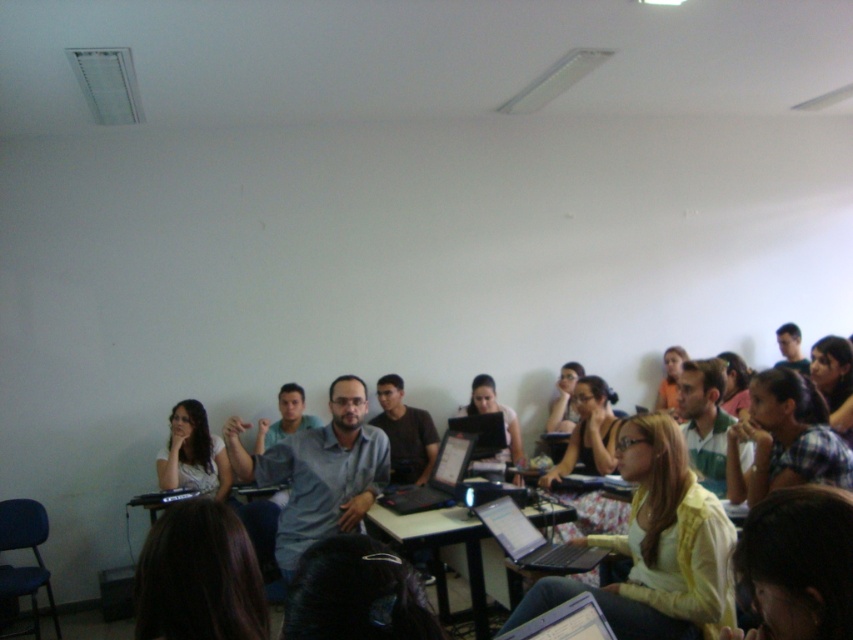
Question: Which point is farther to the camera?

Choices:
 (A) (437, 481)
 (B) (407, 532)
 (C) (527, 632)

Answer: (A)

Question: Which of the following is the closest to the observer?

Choices:
 (A) matte yellow sweater at center
 (B) silver metallic laptop at lower center
 (C) black glossy laptop at center
 (D) matte black laptop at left

Answer: (B)

Question: Does matte black laptop at left have a lesser width compared to silver metallic laptop at lower center?

Choices:
 (A) yes
 (B) no

Answer: (B)

Question: Does silver metallic laptop at center appear over silver metallic laptop at lower center?

Choices:
 (A) no
 (B) yes

Answer: (A)

Question: Which object appears farthest from the camera in this image?

Choices:
 (A) matte black laptop at left
 (B) matte yellow sweater at center

Answer: (A)

Question: Does matte blue shirt at center have a greater width compared to black glossy laptop at center?

Choices:
 (A) no
 (B) yes

Answer: (B)